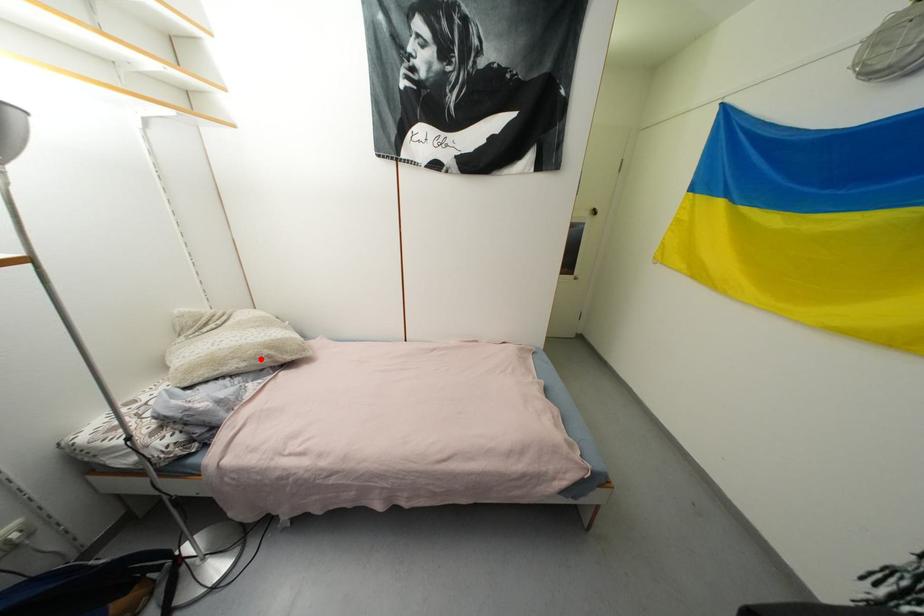
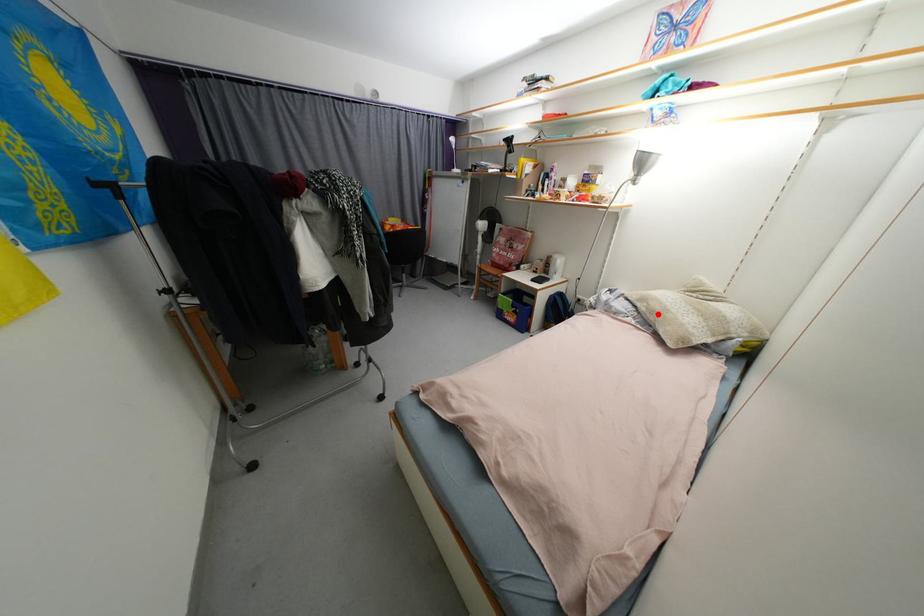
I am providing you with two images of the same scene from different viewpoints. A red point is marked on the first image and another point is marked on the second image. Does the point marked in image1 correspond to the same location as the one in image2?

Yes